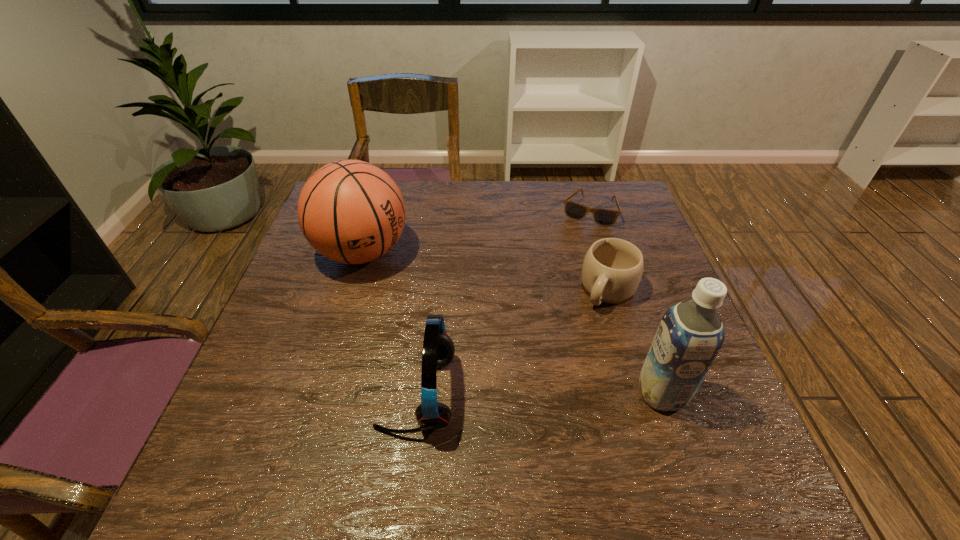
At what (x,y) coordinates should I click in order to perform the action: click on vacant space on the desktop that is between the headset and the soya milk and is positioned on the frames of the shortest object. Please return your answer as a coordinate pair (x, y). The width and height of the screenshot is (960, 540). Looking at the image, I should click on (517, 393).

At what (x,y) coordinates should I click in order to perform the action: click on free space on the desktop that is between the third shortest object and the soya milk and is positioned on the surface of the basketball near the brand logo. Please return your answer as a coordinate pair (x, y). This screenshot has width=960, height=540. Looking at the image, I should click on (523, 393).

Where is `free space on the desktop that is between the third tallest object and the soya milk and is positioned on the side of the mug with the handle`? free space on the desktop that is between the third tallest object and the soya milk and is positioned on the side of the mug with the handle is located at coordinates (545, 393).